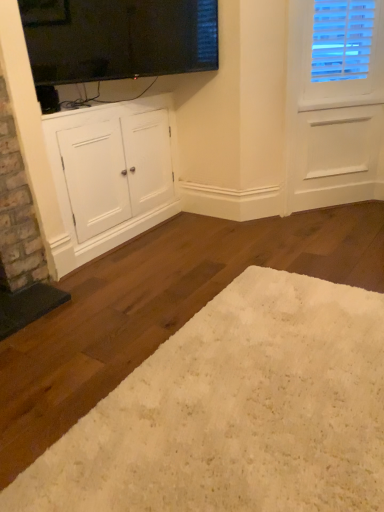
Question: Is white matte cabinet at lower left taller or shorter than black glass window screen at upper center?

Choices:
 (A) tall
 (B) short

Answer: (A)

Question: From a real-world perspective, is white matte cabinet at lower left above or below black glass window screen at upper center?

Choices:
 (A) above
 (B) below

Answer: (B)

Question: Estimate the real-world distances between objects in this image. Which object is farther from the white matte cabinet at lower left?

Choices:
 (A) white shag rug at lower center
 (B) black glass window screen at upper center

Answer: (A)

Question: Which of these objects is positioned farthest from the white shag rug at lower center?

Choices:
 (A) white matte cabinet at lower left
 (B) black glass window screen at upper center

Answer: (B)